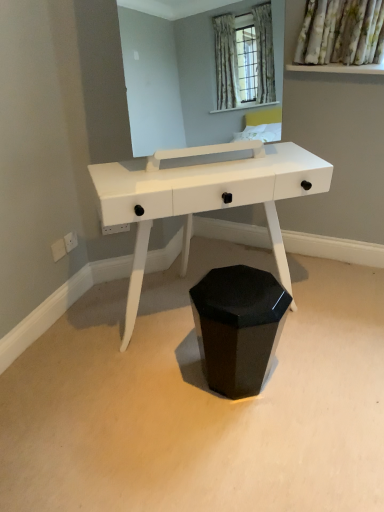
Locate an element on the screen. This screenshot has height=512, width=384. free region under black glossy hexagonal waste bin at center (from a real-world perspective) is located at coordinates (240, 393).